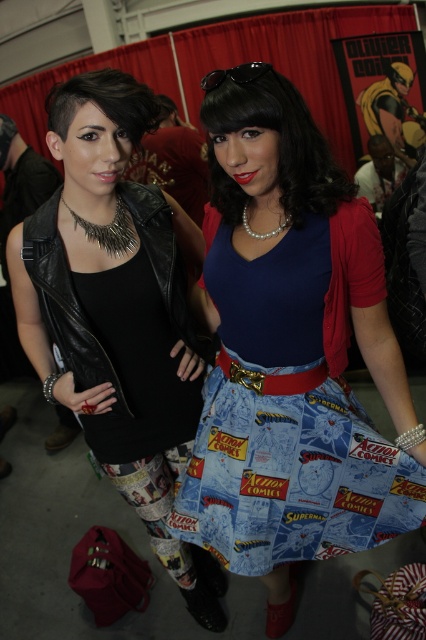
Describe the element at coordinates (293, 406) in the screenshot. I see `comic book fabric skirt at center` at that location.

Does point (359, 404) come farther from viewer compared to point (166, 276)?

Yes, it is behind point (166, 276).

Who is more forward, (x=328, y=356) or (x=166, y=244)?

Point (x=328, y=356) is in front.

Locate an element on the screen. The height and width of the screenshot is (640, 426). comic book fabric skirt at center is located at coordinates (293, 406).

Who is shorter, matte black vest at left or black leather jacket at left?

black leather jacket at left is shorter.

Find the location of a particular element. Image resolution: width=426 pixels, height=640 pixels. matte black vest at left is located at coordinates (118, 310).

Based on the photo, is matte black vest at left positioned before comic book fabric skirt at center?

That is False.

Does matte black vest at left appear over comic book fabric skirt at center?

Actually, matte black vest at left is below comic book fabric skirt at center.

What do you see at coordinates (118, 310) in the screenshot?
I see `matte black vest at left` at bounding box center [118, 310].

The image size is (426, 640). I want to click on matte black vest at left, so click(118, 310).